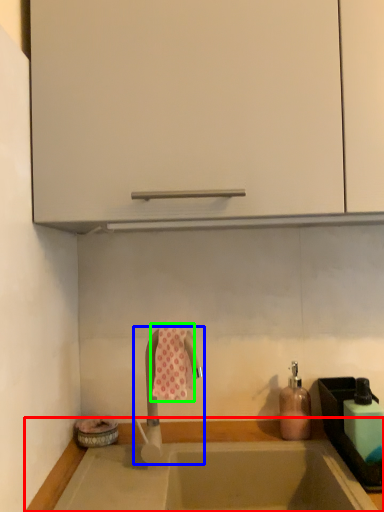
Question: Which object is the farthest from countertop (highlighted by a red box)? Choose among these: tap (highlighted by a blue box) or beach towel (highlighted by a green box).

Choices:
 (A) tap
 (B) beach towel

Answer: (B)